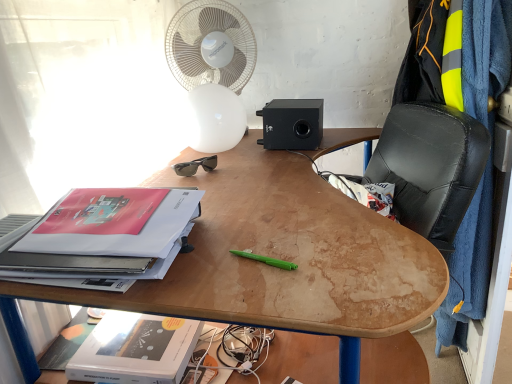
Find the location of a particular element. The width and height of the screenshot is (512, 384). free point behind green plastic pen at center is located at coordinates (263, 221).